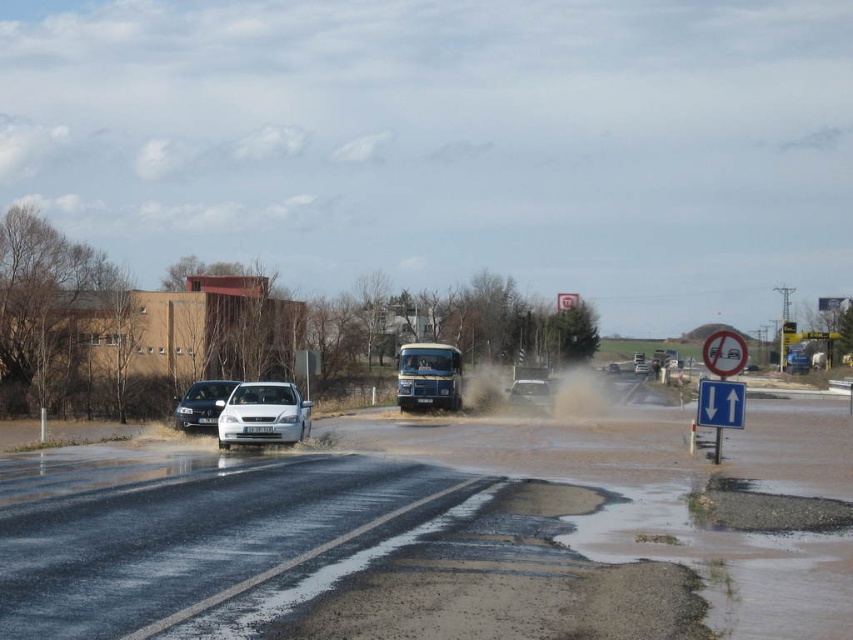
Can you confirm if white glossy sedan at center is positioned to the left of satin white sedan at left?

Incorrect, white glossy sedan at center is not on the left side of satin white sedan at left.

Is white glossy sedan at center behind satin white sedan at left?

No, it is not.

Does point (241, 435) come behind point (184, 424)?

That is False.

Image resolution: width=853 pixels, height=640 pixels. What are the coordinates of `white glossy sedan at center` in the screenshot? It's located at (263, 413).

Does point (415, 388) lie in front of point (512, 385)?

That is True.

Who is lower down, metallic silver bus at center or matte silver suv at center?

matte silver suv at center is below.

Where is `metallic silver bus at center`? This screenshot has height=640, width=853. metallic silver bus at center is located at coordinates [x=428, y=376].

Is blue plastic sign at center right thinner than white plastic sign at upper center?

Indeed, blue plastic sign at center right has a lesser width compared to white plastic sign at upper center.

Looking at this image, does blue plastic sign at center right appear over white plastic sign at upper center?

Incorrect, blue plastic sign at center right is not positioned above white plastic sign at upper center.

Find the location of a particular element. The image size is (853, 640). blue plastic sign at center right is located at coordinates (720, 403).